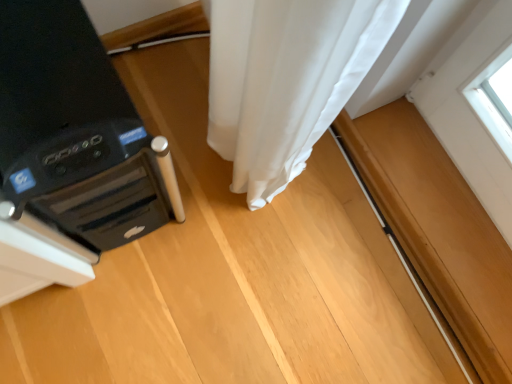
At what (x,y) coordinates should I click in order to perform the action: click on vacant space behind black plastic speaker at left. Please return your answer as a coordinate pair (x, y). Looking at the image, I should click on (163, 74).